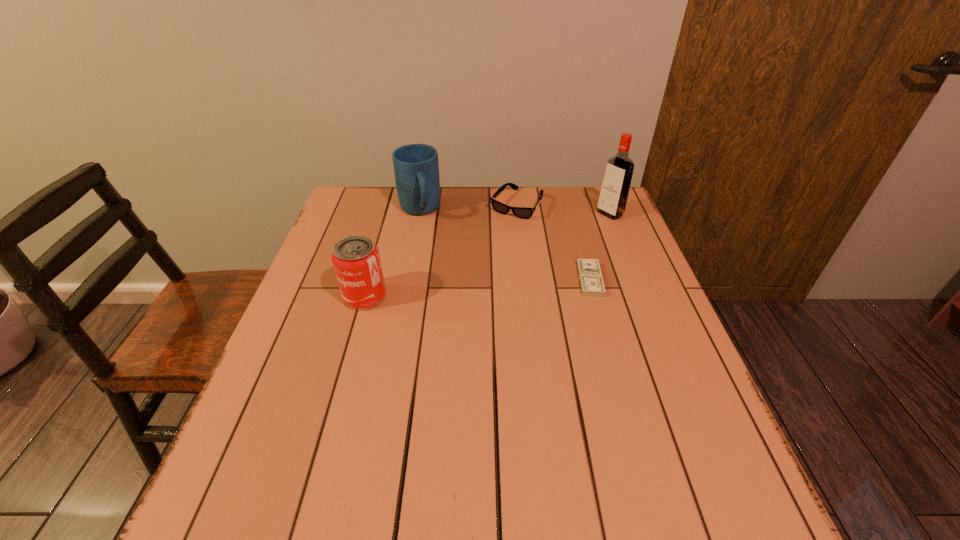
You are a GUI agent. You are given a task and a screenshot of the screen. Output one action in this format:
    pyautogui.click(x=<x>, y=<y>)
    Task: Click on the vacant space on the desktop that is between the third tallest object and the fourth object from left to right and is positioned on the front-facing side of the sunglasses
    Image resolution: width=960 pixels, height=540 pixels.
    Given the screenshot: What is the action you would take?
    pyautogui.click(x=455, y=289)

Locate an element on the screen. The image size is (960, 540). vacant spot on the desktop that is between the can and the second object from right to left and is positioned on the front and back of the vodka is located at coordinates (487, 287).

This screenshot has width=960, height=540. I want to click on vacant spot on the desktop that is between the can and the money and is positioned on the side of the mug with the handle, so click(447, 290).